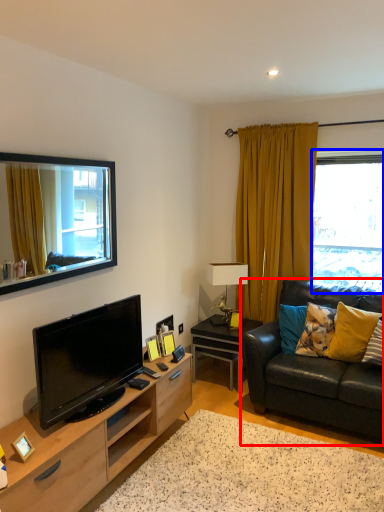
Question: Which of the following is the farthest to the observer, studio couch (highlighted by a red box) or window (highlighted by a blue box)?

Choices:
 (A) studio couch
 (B) window

Answer: (B)